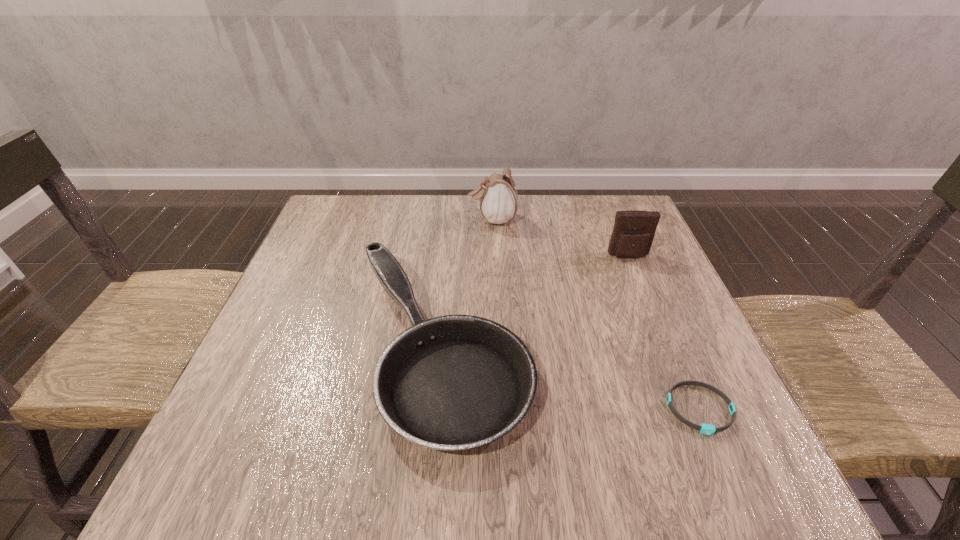
Image resolution: width=960 pixels, height=540 pixels. I want to click on vacant region between the third shortest object and the wristband, so click(664, 333).

Where is `vacant region between the nearer pouch and the left pouch`? The width and height of the screenshot is (960, 540). vacant region between the nearer pouch and the left pouch is located at coordinates (561, 238).

Choose which object is the third nearest neighbor to the wristband. Please provide its 2D coordinates. Your answer should be formatted as a tuple, i.e. [(x, y)], where the tuple contains the x and y coordinates of a point satisfying the conditions above.

[(498, 202)]

Locate an element on the screen. Image resolution: width=960 pixels, height=540 pixels. object identified as the closest to the tallest object is located at coordinates (456, 382).